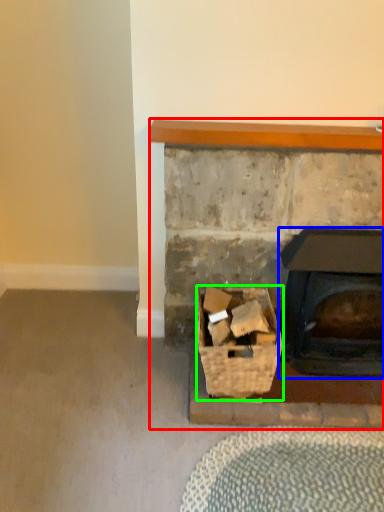
Question: Which object is positioned farthest from fireplace (highlighted by a red box)? Select from wood burning stove (highlighted by a blue box) and basket (highlighted by a green box).

Choices:
 (A) wood burning stove
 (B) basket

Answer: (B)